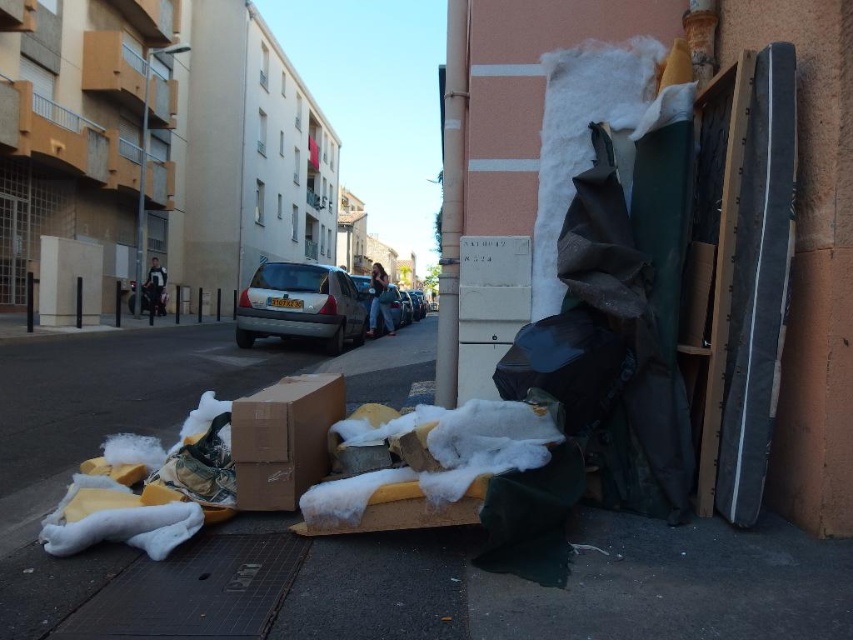
You are standing in the urban street scene and want to place a small potted plant between the two points marked as point (x=55, y=410) and point (x=347, y=314). Which point should the plant be closer to in order to be nearer to the viewer?

The plant should be placed closer to point (x=55, y=410) because it is closer to the viewer than point (x=347, y=314).

You are a delivery person trying to park your van next to the white foam at lower left and the matte gray hatchback at center. Based on the scene, which vehicle has a wider body?

The white foam at lower left is wider than the matte gray hatchback at center, so the white foam at lower left has a wider body.